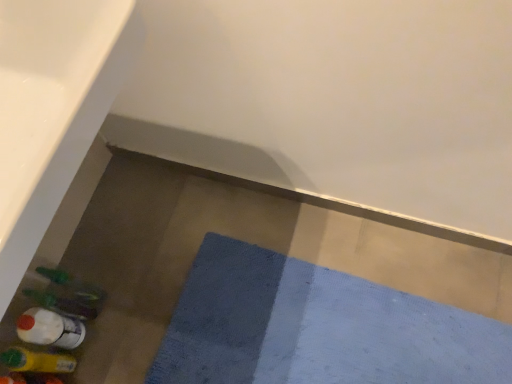
Where is `free space between translucent plastic bottle at lower left, the second bottle when ordered from bottom to top, and blue textured bath mat at lower center`? This screenshot has width=512, height=384. free space between translucent plastic bottle at lower left, the second bottle when ordered from bottom to top, and blue textured bath mat at lower center is located at coordinates (140, 309).